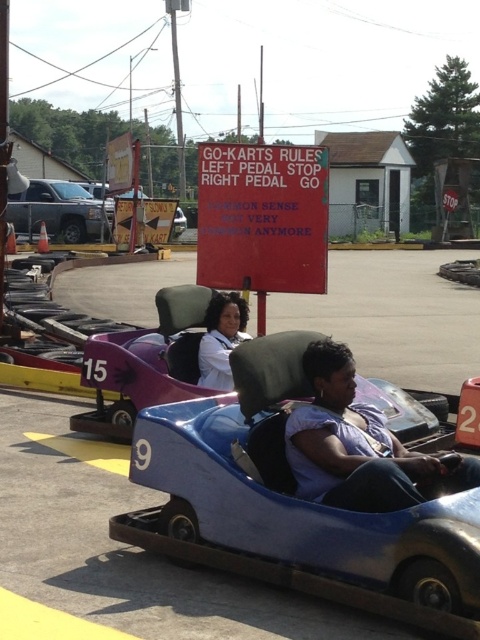
What does the point at coordinates (145, 364) represent in the image?

The point at coordinates (145, 364) indicates the blue plastic go kart at center.

You are a photographer positioned at the camera location. You want to take a photo focusing on the two points labeled point (x=252, y=426) and point (x=72, y=214). Which point will appear larger in the photo?

Point (x=252, y=426) is closer to the camera than point (x=72, y=214), so it will appear larger in the photo.